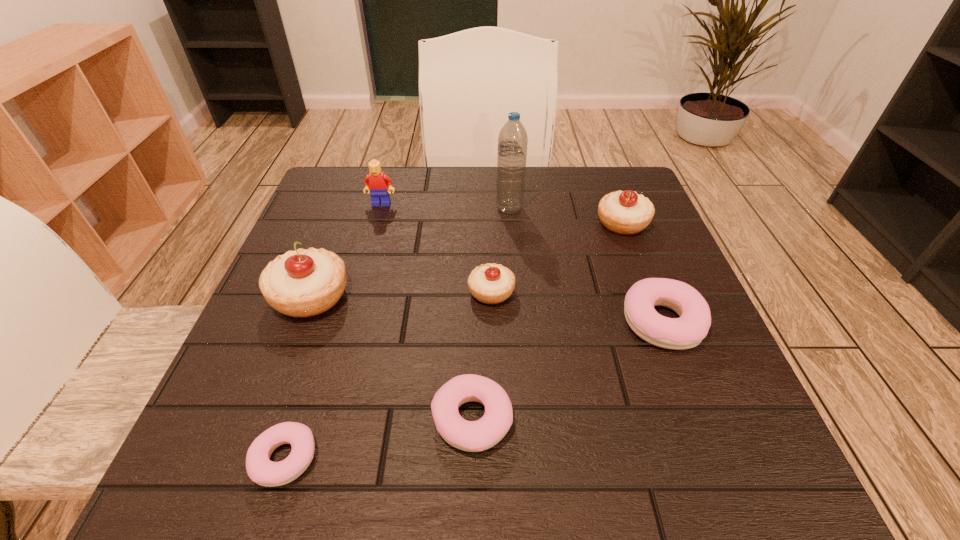
What are the coordinates of `vacant region located on the left of the rightmost pink pastry` in the screenshot? It's located at (439, 322).

The height and width of the screenshot is (540, 960). Identify the location of vacant space located on the right of the second biggest pink pastry. (700, 420).

Find the location of a particular element. This screenshot has height=540, width=960. free spot located 0.240m on the right of the smallest pink pastry is located at coordinates (490, 458).

The image size is (960, 540). In order to click on water bottle at the far edge in this screenshot , I will do `click(512, 142)`.

At what (x,y) coordinates should I click in order to perform the action: click on Lego positioned at the far edge. Please return your answer as a coordinate pair (x, y). The width and height of the screenshot is (960, 540). Looking at the image, I should click on (376, 182).

I want to click on pastry present at the far edge, so click(x=624, y=212).

You are a GUI agent. You are given a task and a screenshot of the screen. Output one action in this format:
    pyautogui.click(x=<x>, y=<y>)
    Task: Click on the Lego at the left edge
    
    Given the screenshot: What is the action you would take?
    pyautogui.click(x=376, y=182)

The height and width of the screenshot is (540, 960). What are the coordinates of `object that is at the far left corner` in the screenshot? It's located at (376, 182).

Identify the location of object situated at the near left corner. (260, 469).

Find the location of a particular element. object located in the far right corner section of the desktop is located at coordinates (624, 212).